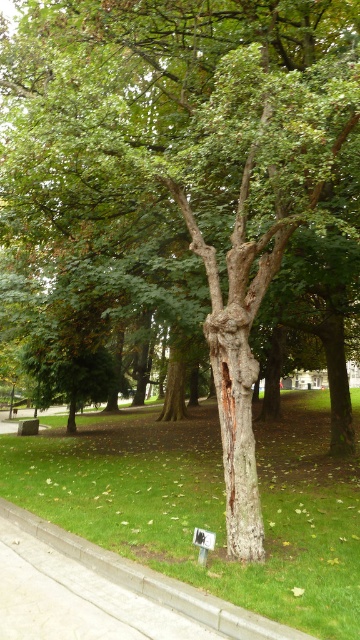
You are standing in the park and want to place a small bench between the green grass at center and the concrete at lower left. Based on their positions, which object should the bench be closer to?

The concrete at lower left is behind green grass at center, so the bench should be placed closer to the green grass at center since it is in front.

You are standing at the base of the tree and want to place a 3.5 meter long wooden bench between the green grass at center and the tree. Will the bench fit without overlapping either the tree or the grass?

The distance between the tree and the green grass at center is 3.39 meters. Since the bench is 3.5 meters long, it will not fit as it is slightly longer than the available space between them.